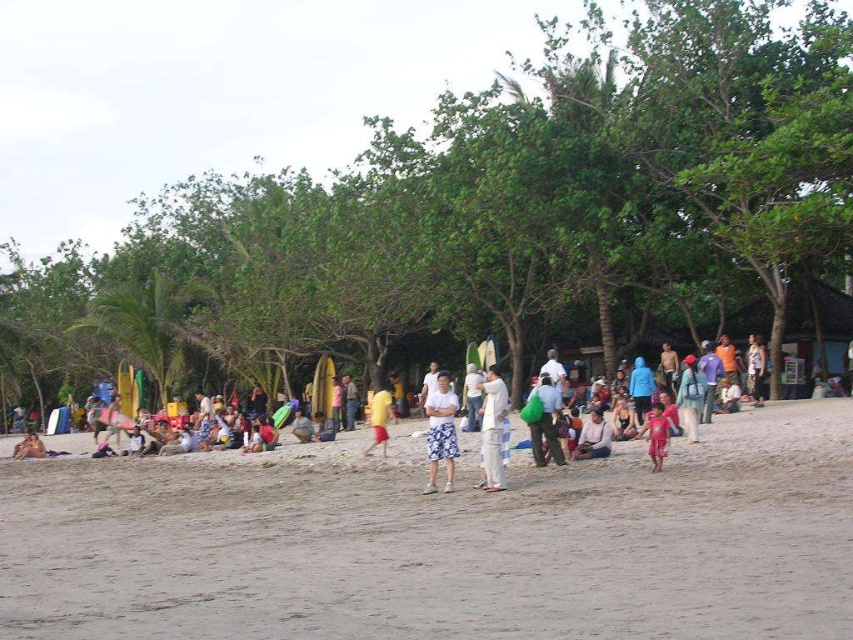
Does white cotton shirt at center appear over pink fabric child at center?

Correct, white cotton shirt at center is located above pink fabric child at center.

In the scene shown: Can you confirm if white cotton shirt at center is positioned below pink fabric child at center?

No, white cotton shirt at center is not below pink fabric child at center.

This screenshot has width=853, height=640. Find the location of `white cotton shirt at center`. white cotton shirt at center is located at coordinates (492, 429).

What do you see at coordinates (486, 214) in the screenshot? I see `green leafy tree at center` at bounding box center [486, 214].

Is point (419, 257) less distant than point (437, 433)?

That is False.

You are a GUI agent. You are given a task and a screenshot of the screen. Output one action in this format:
    pyautogui.click(x=<x>, y=<y>)
    Task: Click on the green leafy tree at center
    
    Given the screenshot: What is the action you would take?
    pyautogui.click(x=486, y=214)

Based on the photo, is white cotton shirt at center thinner than green fabric bag at center?

No.

Find the location of a particular element. This screenshot has width=853, height=640. white cotton shirt at center is located at coordinates (492, 429).

Where is `white cotton shirt at center`? The width and height of the screenshot is (853, 640). white cotton shirt at center is located at coordinates (492, 429).

The image size is (853, 640). Find the location of `white cotton shirt at center`. white cotton shirt at center is located at coordinates point(492,429).